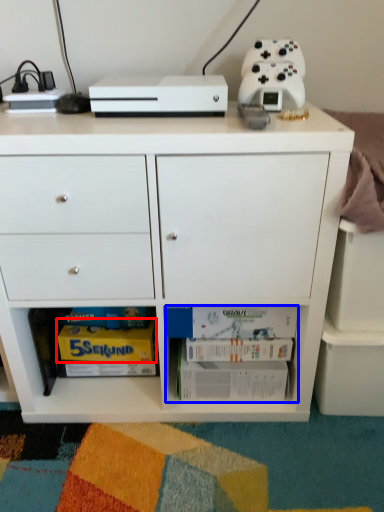
Question: Which of the following is the farthest to the observer, magazine (highlighted by a red box) or book (highlighted by a blue box)?

Choices:
 (A) magazine
 (B) book

Answer: (A)